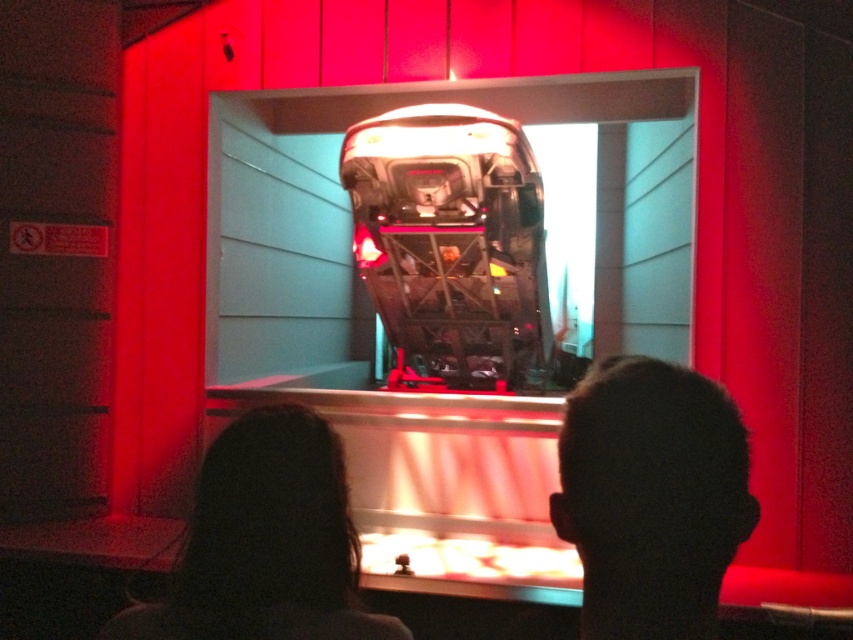
Between silky black hair at center and dark brown hair at lower left, which one appears on the right side from the viewer's perspective?

From the viewer's perspective, silky black hair at center appears more on the right side.

Who is more forward, (709, 429) or (309, 504)?

Positioned in front is point (709, 429).

The image size is (853, 640). In order to click on silky black hair at center in this screenshot , I will do `click(651, 497)`.